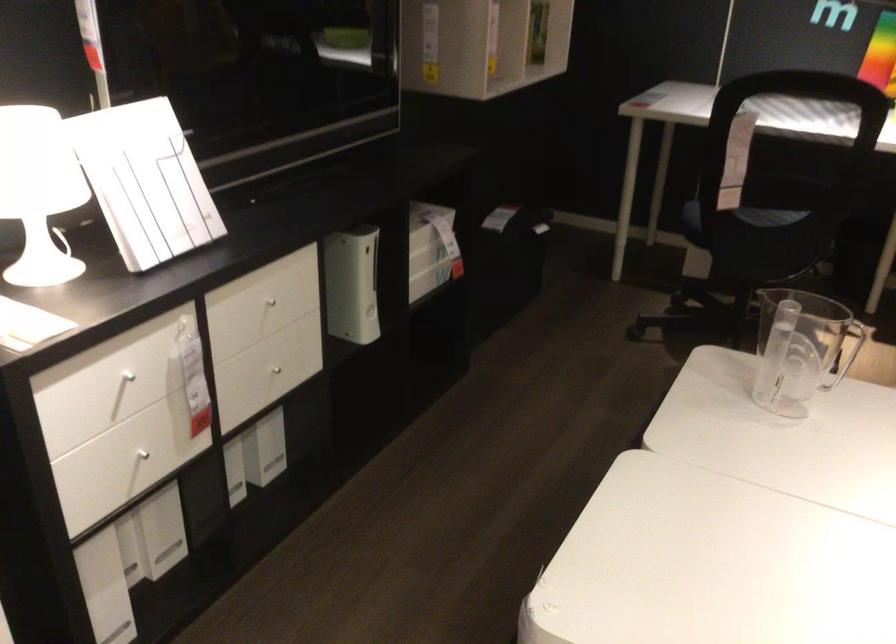
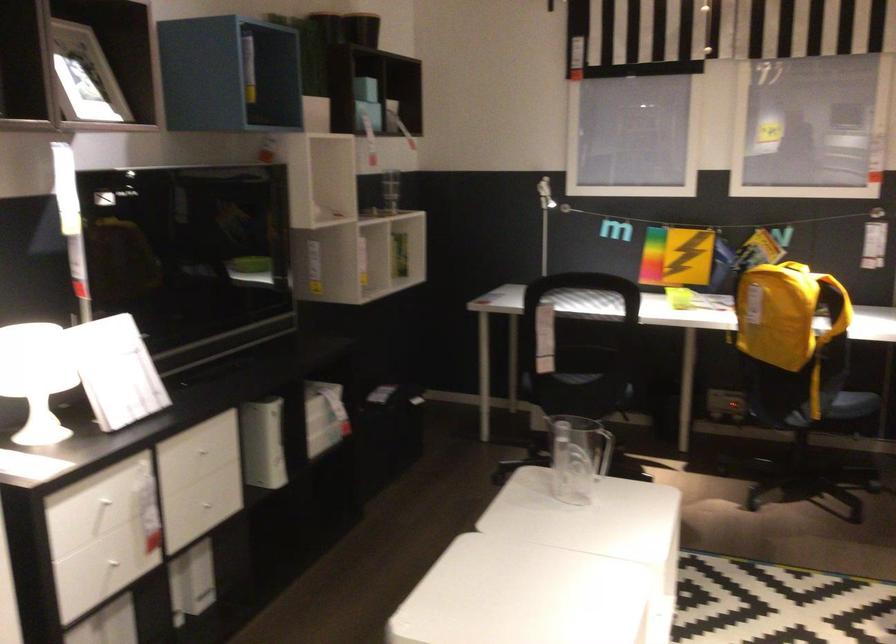
In the second image, find the point that corresponds to (116,372) in the first image.

(99, 500)